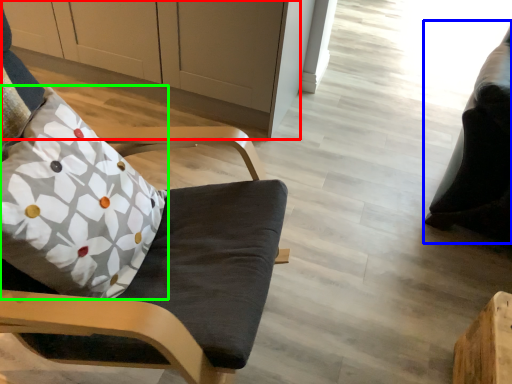
Question: Based on their relative distances, which object is farther from cabinetry (highlighted by a red box)? Choose from bean bag chair (highlighted by a blue box) and pillow (highlighted by a green box).

Choices:
 (A) bean bag chair
 (B) pillow

Answer: (A)